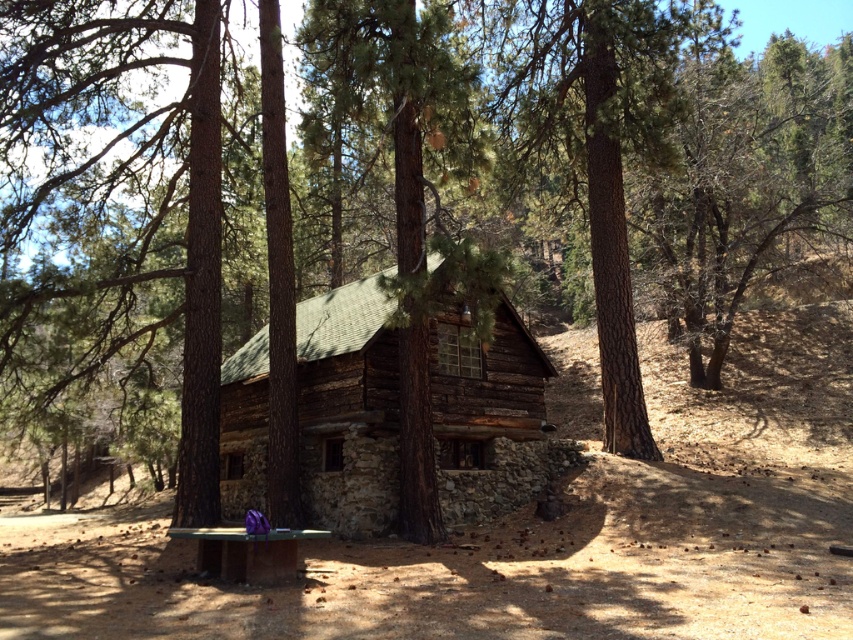
Which is behind, point (303, 488) or point (277, 570)?

Positioned behind is point (303, 488).

Can you confirm if weathered wood cabin at center is positioned to the left of purple fabric picnic table at lower left?

In fact, weathered wood cabin at center is to the right of purple fabric picnic table at lower left.

Between point (450, 420) and point (198, 552), which one is positioned behind?

The point (450, 420) is more distant.

At what (x,y) coordinates should I click in order to perform the action: click on weathered wood cabin at center. Please return your answer as a coordinate pair (x, y). The height and width of the screenshot is (640, 853). Looking at the image, I should click on (347, 408).